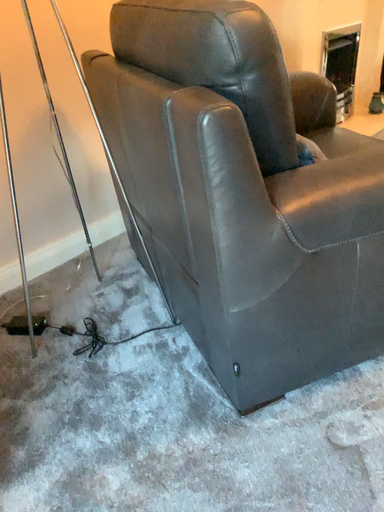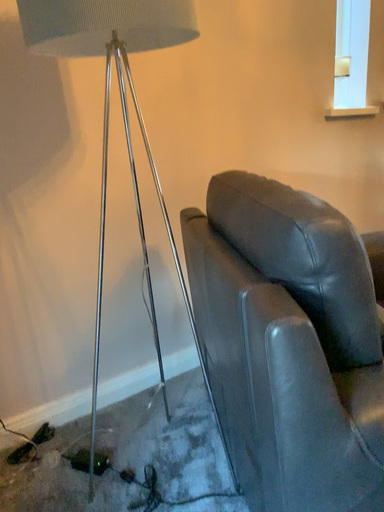
Question: Which way did the camera rotate in the video?

Choices:
 (A) rotated left
 (B) rotated right

Answer: (A)